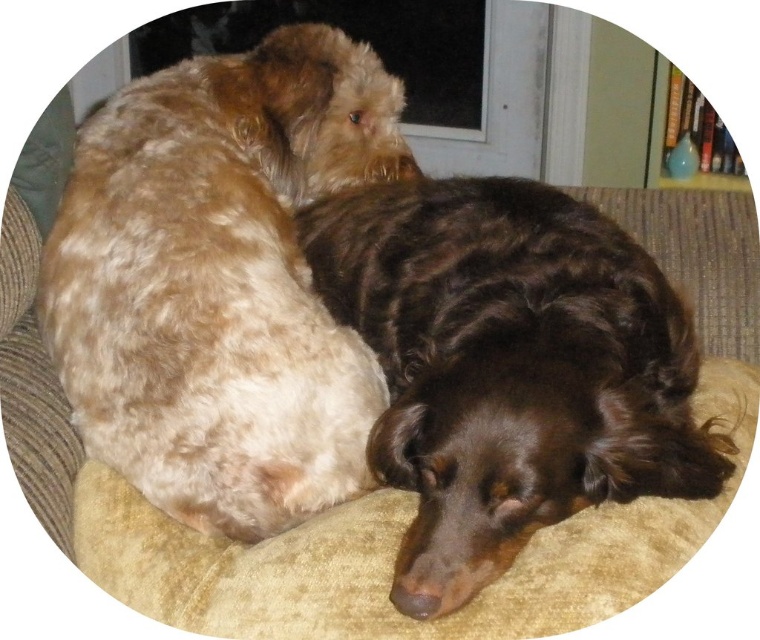
Question: Based on their relative distances, which object is nearer to the beige fabric dog bed at center?

Choices:
 (A) brown shaggy dog at lower right
 (B) brown shaggy dog at upper left

Answer: (A)

Question: Considering the relative positions of brown shaggy dog at upper left and beige fabric dog bed at center in the image provided, where is brown shaggy dog at upper left located with respect to beige fabric dog bed at center?

Choices:
 (A) below
 (B) above

Answer: (B)

Question: Which of the following is the farthest from the observer?

Choices:
 (A) brown shaggy dog at upper left
 (B) brown shaggy dog at lower right
 (C) beige fabric dog bed at center

Answer: (A)

Question: From the image, what is the correct spatial relationship of brown shaggy dog at upper left in relation to beige fabric dog bed at center?

Choices:
 (A) below
 (B) above

Answer: (B)

Question: Is brown shaggy dog at upper left closer to camera compared to beige fabric dog bed at center?

Choices:
 (A) no
 (B) yes

Answer: (A)

Question: Which point is closer to the camera taking this photo?

Choices:
 (A) (736, 378)
 (B) (143, 368)
 (C) (638, 269)

Answer: (B)